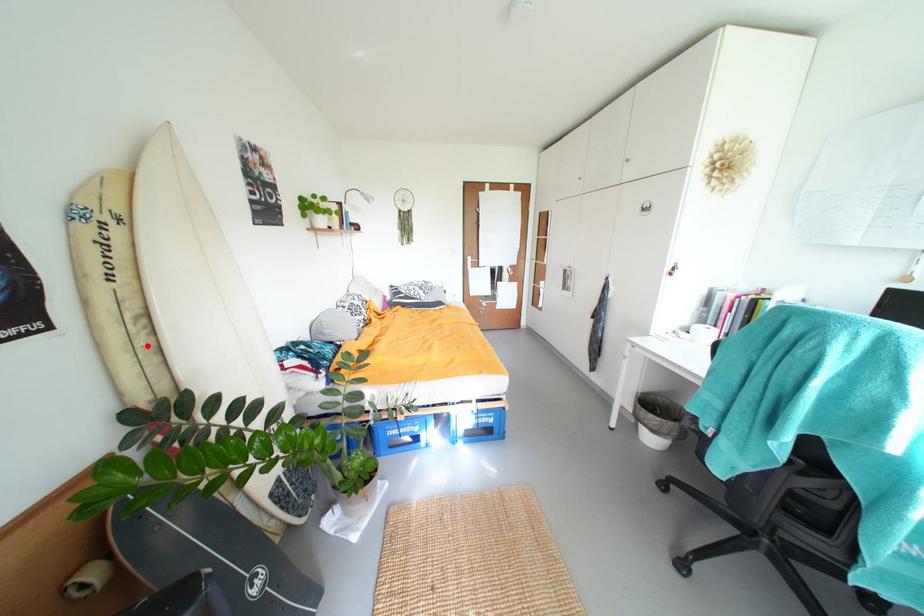
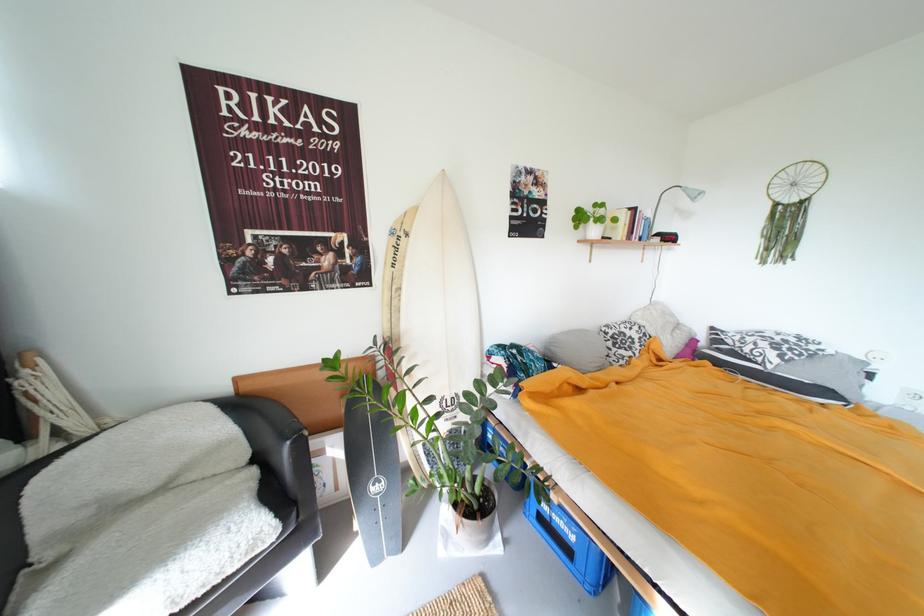
Locate, in the second image, the point that corresponds to the highlighted location in the first image.

(402, 306)